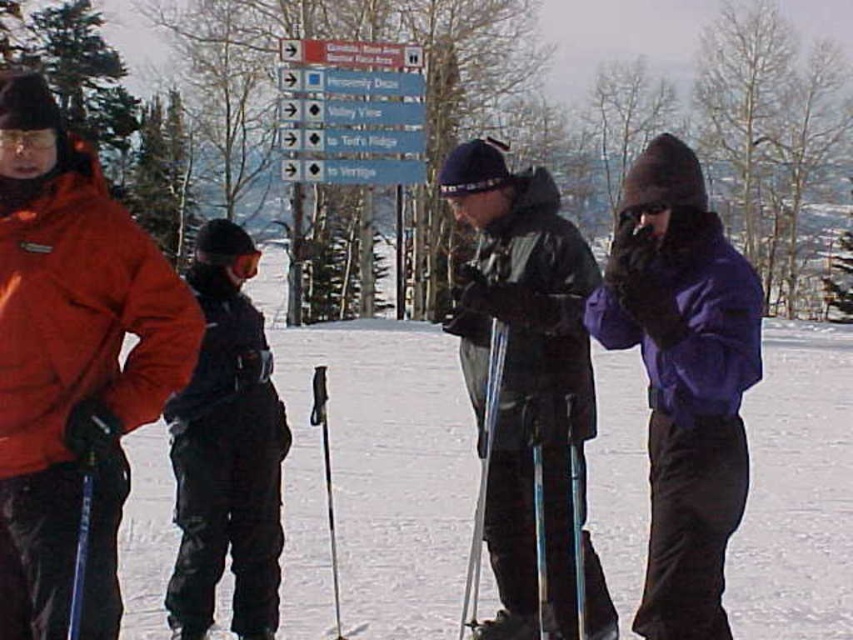
You are standing at the point labeled point (650, 186) and want to walk towards the point labeled point (467, 381). Given that both points are on the same slope, will you be walking uphill or downhill?

Since point (650, 186) is closer to the camera than point (467, 381), you will be walking uphill because you are moving away from the camera, which typically corresponds to going up a slope in such scenes.

You are a photographer trying to capture a clear shot of the matte black ski pole at center and the black matte ski pants at center. Since both are black, you want to ensure the pole is visible in the photo. Based on their positions, can you tell if the ski pole at center will be distinguishable from the ski pants at center?

The matte black ski pole at center is located above the black matte ski pants at center, so the pole will be distinguishable as it is positioned higher up relative to the pants.